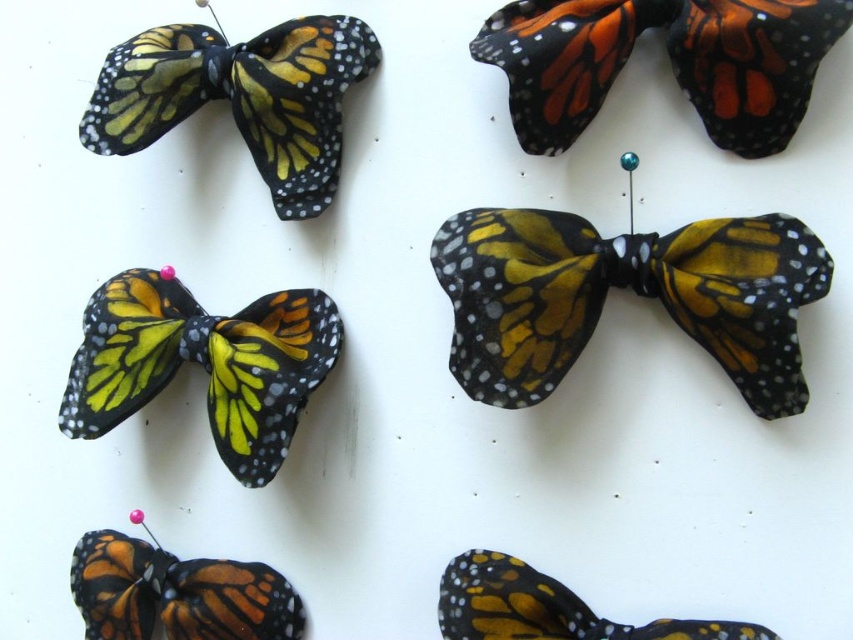
Question: Which is farther from the matte black bow at bottom right?

Choices:
 (A) orange matte fabric butterfly at upper center
 (B) shiny yellow fabric butterfly at center
 (C) orange-yellow fabric butterfly at lower left

Answer: (A)

Question: Which point appears closest to the camera in this image?

Choices:
 (A) (746, 310)
 (B) (523, 124)
 (C) (517, 630)

Answer: (A)

Question: Is orange matte fabric butterfly at upper center thinner than orange-yellow fabric butterfly at lower left?

Choices:
 (A) no
 (B) yes

Answer: (A)

Question: Which point is closer to the camera taking this photo?

Choices:
 (A) (721, 49)
 (B) (334, 45)
 (C) (669, 275)
 (D) (199, 618)

Answer: (C)

Question: Does orange matte fabric butterfly at upper center have a smaller size compared to matte fabric butterfly at upper left?

Choices:
 (A) yes
 (B) no

Answer: (B)

Question: Observing the image, what is the correct spatial positioning of matte fabric butterfly at upper left in reference to matte black bow at bottom right?

Choices:
 (A) left
 (B) right

Answer: (A)